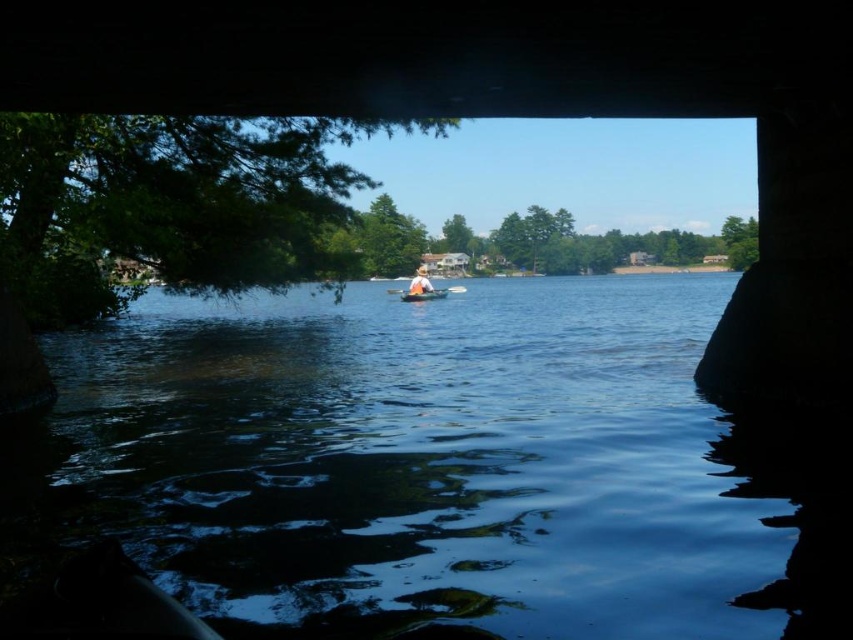
You are standing under the bridge and looking out at the water. There are two points marked on the water surface in front of you. The first point is at coordinates point (419,292) and the second point is at point (397,291). Which point is closer to you?

Point (419,292) is closer to the viewer than point (397,291).

You are standing under the bridge and see the white fabric hat at center and the orange plastic paddle at center. Which object appears bigger in your view?

The white fabric hat at center appears larger than the orange plastic paddle at center.

You are standing under the bridge and see the white fabric hat at center and the orange plastic paddle at center. Which object is narrower?

The white fabric hat at center is thinner than the orange plastic paddle at center.